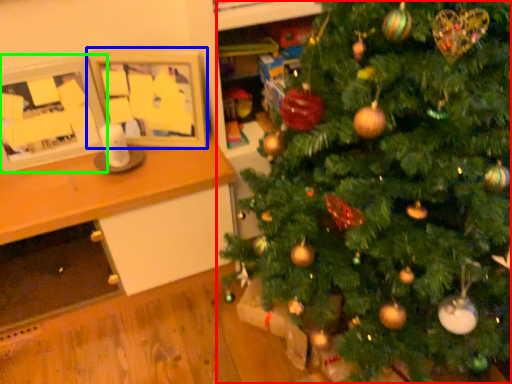
Question: Estimate the real-world distances between objects in this image. Which object is farther from christmas tree (highlighted by a red box), picture frame (highlighted by a blue box) or picture frame (highlighted by a green box)?

Choices:
 (A) picture frame
 (B) picture frame

Answer: (B)